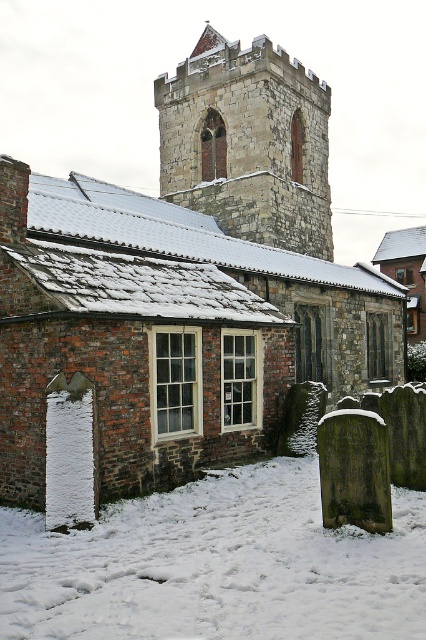
Question: In this image, where is white powdery snow at lower center located relative to stone tower at upper center?

Choices:
 (A) right
 (B) left

Answer: (A)

Question: Which point appears closest to the camera in this image?

Choices:
 (A) (23, 541)
 (B) (164, 131)

Answer: (A)

Question: Which point is closer to the camera?

Choices:
 (A) (261, 552)
 (B) (241, 163)

Answer: (A)

Question: Observing the image, what is the correct spatial positioning of white powdery snow at lower center in reference to stone tower at upper center?

Choices:
 (A) right
 (B) left

Answer: (A)

Question: Is white powdery snow at lower center behind stone tower at upper center?

Choices:
 (A) yes
 (B) no

Answer: (B)